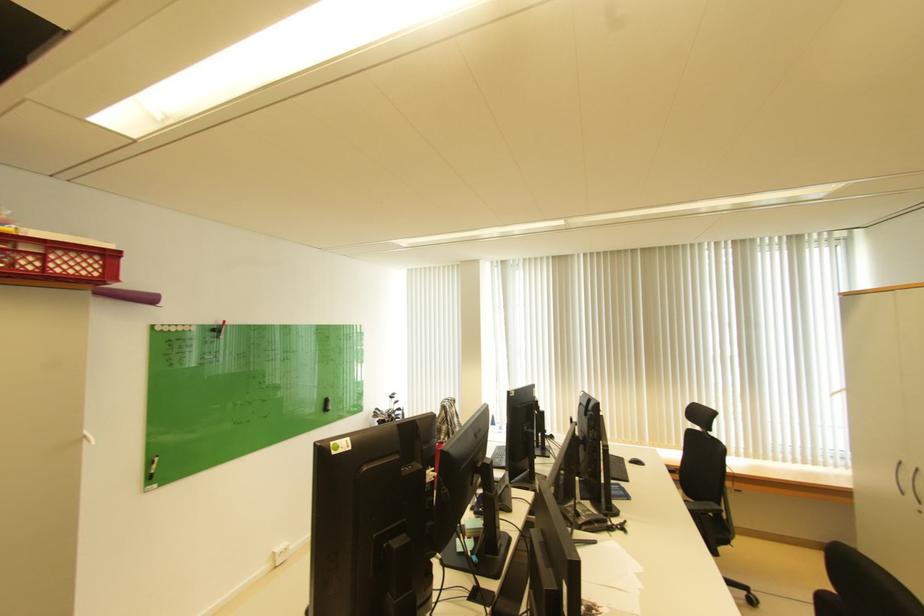
Where is `red-capped board marker`? The width and height of the screenshot is (924, 616). red-capped board marker is located at coordinates (222, 329).